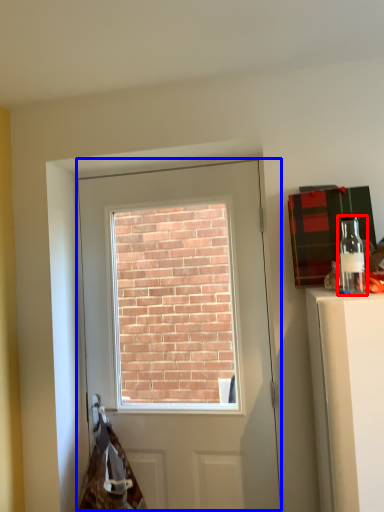
Question: Which object is closer to the camera taking this photo, bottle (highlighted by a red box) or door (highlighted by a blue box)?

Choices:
 (A) bottle
 (B) door

Answer: (A)